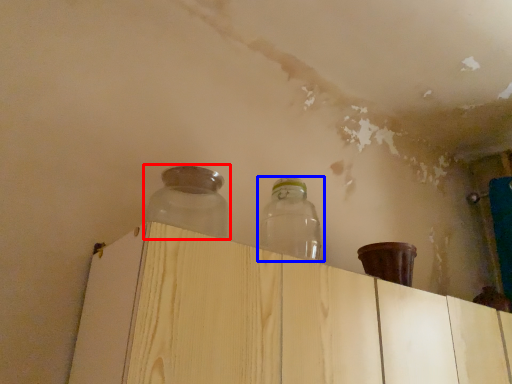
Question: Which point is closer to the camera, bottle (highlighted by a red box) or bottle (highlighted by a blue box)?

Choices:
 (A) bottle
 (B) bottle

Answer: (A)